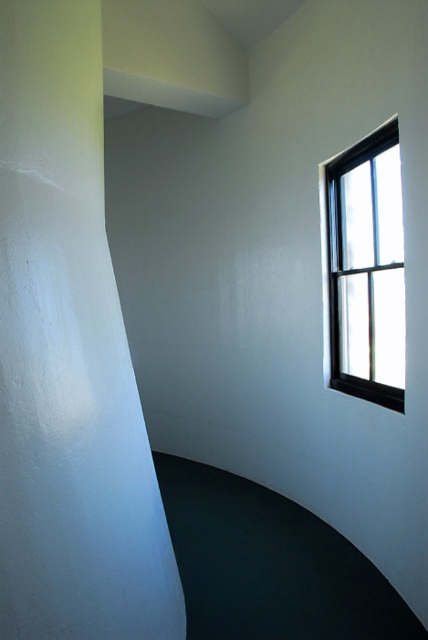
How much distance is there between white matte pillar at left and black frame window at upper right?

The distance of white matte pillar at left from black frame window at upper right is 3.82 feet.

From the picture: Is white matte pillar at left smaller than black frame window at upper right?

Incorrect, white matte pillar at left is not smaller in size than black frame window at upper right.

Is point (47, 440) more distant than point (398, 248)?

No, it is not.

The width and height of the screenshot is (428, 640). In order to click on white matte pillar at left in this screenshot , I will do `click(68, 358)`.